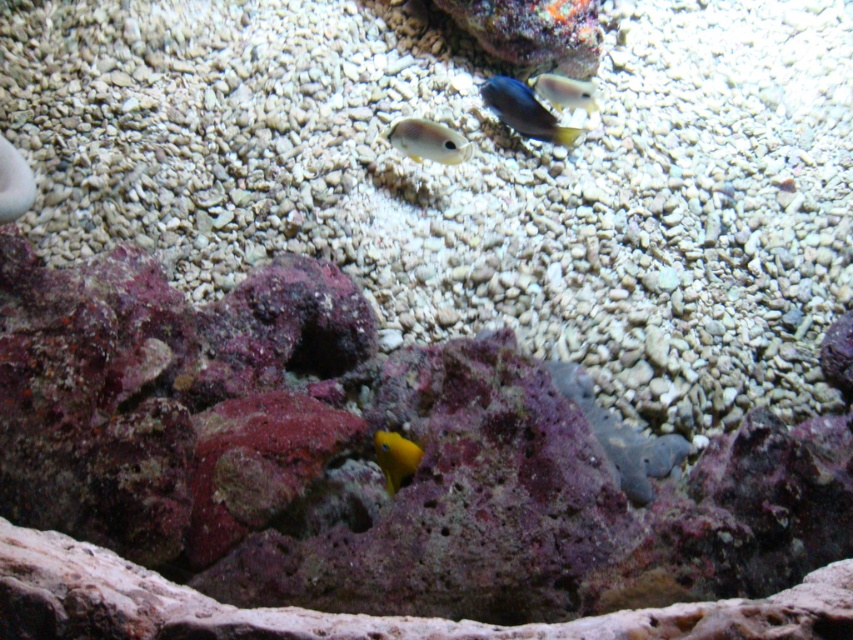
Question: Does translucent yellow fish at center have a greater width compared to yellow matte fish at center?

Choices:
 (A) no
 (B) yes

Answer: (B)

Question: Which point is farther to the camera?

Choices:
 (A) translucent yellow fish at center
 (B) translucent white fish at center

Answer: (B)

Question: Does yellow matte fish at center come behind translucent white fish at center?

Choices:
 (A) yes
 (B) no

Answer: (B)

Question: Which object is positioned closest to the yellow matte fish at center?

Choices:
 (A) translucent yellow fish at center
 (B) blue glossy fish at center
 (C) translucent white fish at center

Answer: (A)

Question: Does yellow matte fish at center appear on the left side of translucent white fish at center?

Choices:
 (A) no
 (B) yes

Answer: (B)

Question: Which object appears farthest from the camera in this image?

Choices:
 (A) blue glossy fish at center
 (B) yellow matte fish at center
 (C) translucent yellow fish at center
 (D) translucent white fish at center

Answer: (D)